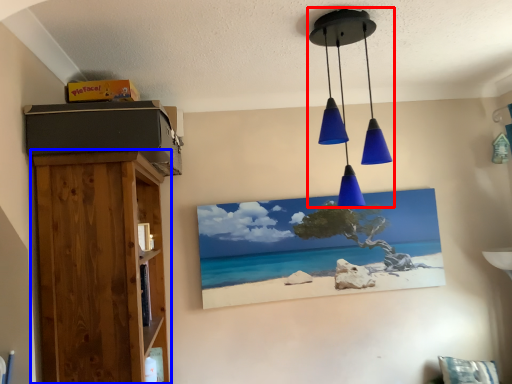
Question: Which object is closer to the camera taking this photo, lamp (highlighted by a red box) or furniture (highlighted by a blue box)?

Choices:
 (A) lamp
 (B) furniture

Answer: (B)